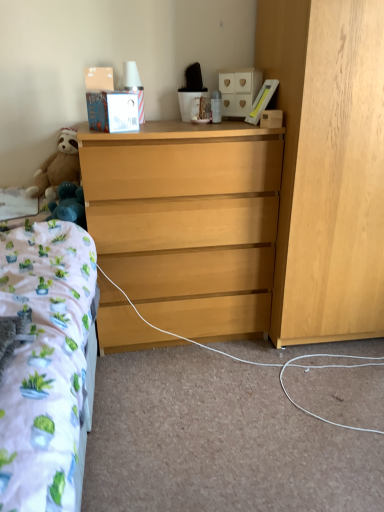
What do you see at coordinates (327, 166) in the screenshot? The width and height of the screenshot is (384, 512). I see `light wood dresser at right, which is the 1th cabinetry from bottom to top` at bounding box center [327, 166].

The image size is (384, 512). Describe the element at coordinates (239, 90) in the screenshot. I see `white matte cabinet at upper center, the 2th cabinetry from the right` at that location.

Find the location of a particular element. The image size is (384, 512). light wood dresser at right, the 2th cabinetry in the left-to-right sequence is located at coordinates (327, 166).

Which point is more distant from viewer, (117, 309) or (75, 181)?

Positioned behind is point (75, 181).

Considering their positions, is light wood dresser at center located in front of or behind brown plush teddy bear at left?

light wood dresser at center is positioned closer to the viewer than brown plush teddy bear at left.

Based on the photo, from their relative heights in the image, would you say light wood dresser at center is taller or shorter than brown plush teddy bear at left?

In the image, light wood dresser at center appears to be taller than brown plush teddy bear at left.

Which is in front, point (254, 280) or point (73, 201)?

The point (73, 201) is in front.

Is light wood dresser at center positioned with its back to blue plush toy at left?

No, light wood dresser at center is not facing the opposite direction of blue plush toy at left.

Based on the photo, which of these two, light wood dresser at center or blue plush toy at left, is wider?

Wider between the two is light wood dresser at center.

Can you tell me how much light wood dresser at center and blue plush toy at left differ in facing direction?

0.427 degrees separate the facing orientations of light wood dresser at center and blue plush toy at left.

Based on the photo, could you tell me if blue plush toy at left is facing white matte cabinet at upper center, which appears as the second cabinetry when ordered from the bottom?

No, blue plush toy at left is not aimed at white matte cabinet at upper center, which appears as the second cabinetry when ordered from the bottom.

Considering the sizes of blue plush toy at left and white matte cabinet at upper center, which appears as the second cabinetry when ordered from the bottom, in the image, is blue plush toy at left wider or thinner than white matte cabinet at upper center, which appears as the second cabinetry when ordered from the bottom,?

Considering their sizes, blue plush toy at left looks broader than white matte cabinet at upper center, which appears as the second cabinetry when ordered from the bottom.

Between point (81, 197) and point (233, 90), which one is positioned in front?

The point (81, 197) is closer.

Do you think wooden box at upper right is within light wood dresser at right, which is the first cabinetry from right to left, or outside of it?

wooden box at upper right is spatially situated outside light wood dresser at right, which is the first cabinetry from right to left.

Relative to light wood dresser at right, which is the 1th cabinetry from bottom to top, is wooden box at upper right in front or behind?

In the image, wooden box at upper right appears behind light wood dresser at right, which is the 1th cabinetry from bottom to top.

From the image's perspective, which is below, blue plush toy at left or wooden box at upper right?

blue plush toy at left.

Is blue plush toy at left not near wooden box at upper right?

blue plush toy at left is near wooden box at upper right, not far away.

How different are the orientations of blue plush toy at left and wooden box at upper right in degrees?

They differ by 0.209 degrees in their facing directions.

Does blue plush toy at left have a greater height compared to wooden box at upper right?

Correct, blue plush toy at left is much taller as wooden box at upper right.

In the scene shown: Considering the relative positions of light wood dresser at center and white matte cabinet at upper center, which appears as the second cabinetry when ordered from the bottom, in the image provided, is light wood dresser at center to the left or to the right of white matte cabinet at upper center, which appears as the second cabinetry when ordered from the bottom,?

Based on their positions, light wood dresser at center is located to the left of white matte cabinet at upper center, which appears as the second cabinetry when ordered from the bottom.

In the image, is light wood dresser at center positioned in front of or behind white matte cabinet at upper center, the first cabinetry when ordered from left to right?

light wood dresser at center is positioned closer to the viewer than white matte cabinet at upper center, the first cabinetry when ordered from left to right.

Can you confirm if light wood dresser at center is wider than white matte cabinet at upper center, the 2th cabinetry from the right?

Correct, the width of light wood dresser at center exceeds that of white matte cabinet at upper center, the 2th cabinetry from the right.

How different are the orientations of light wood dresser at center and white matte cabinet at upper center, the 2th cabinetry from the right, in degrees?

46.9 degrees separate the facing orientations of light wood dresser at center and white matte cabinet at upper center, the 2th cabinetry from the right.

Is light wood dresser at center at the back of brown plush teddy bear at left?

That's not correct — brown plush teddy bear at left is not looking away from light wood dresser at center.

Is brown plush teddy bear at left positioned behind light wood dresser at center?

Yes, brown plush teddy bear at left is further from the camera.

Is brown plush teddy bear at left not within light wood dresser at center?

brown plush teddy bear at left is positioned outside light wood dresser at center.

Identify the location of teddy bear that is above the light wood dresser at center (from the image's perspective). This screenshot has height=512, width=384. (58, 166).

Where is `desk in front of the blue plush toy at left`? The image size is (384, 512). desk in front of the blue plush toy at left is located at coordinates (187, 221).

Which object lies nearer to the anchor point light wood dresser at right, the 2th cabinetry from the top, white matte cabinet at upper center, acting as the 1th cabinetry starting from the top, or wooden box at upper right?

wooden box at upper right is positioned closer to the anchor light wood dresser at right, the 2th cabinetry from the top.

Looking at the image, which one is located closer to light wood dresser at right, the 2th cabinetry in the left-to-right sequence, white matte cabinet at upper center, the 2th cabinetry from the right, or blue plush toy at left?

Among the two, white matte cabinet at upper center, the 2th cabinetry from the right, is located nearer to light wood dresser at right, the 2th cabinetry in the left-to-right sequence.

Estimate the real-world distances between objects in this image. Which object is further from light wood dresser at center, white matte cabinet at upper center, the 2th cabinetry from the right, or wooden box at upper right?

Based on the image, white matte cabinet at upper center, the 2th cabinetry from the right, appears to be further to light wood dresser at center.

When comparing their distances from brown plush teddy bear at left, does white matte cabinet at upper center, which appears as the second cabinetry when ordered from the bottom, or light wood dresser at right, the 2th cabinetry in the left-to-right sequence, seem closer?

white matte cabinet at upper center, which appears as the second cabinetry when ordered from the bottom, is closer to brown plush teddy bear at left.

Looking at the image, which one is located closer to light wood dresser at right, which is the first cabinetry from right to left, brown plush teddy bear at left or wooden box at upper right?

wooden box at upper right is closer to light wood dresser at right, which is the first cabinetry from right to left.

Estimate the real-world distances between objects in this image. Which object is closer to white matte cabinet at upper center, the first cabinetry when ordered from left to right, wooden box at upper right or light wood dresser at center?

The object closer to white matte cabinet at upper center, the first cabinetry when ordered from left to right, is wooden box at upper right.

Considering their positions, is brown plush teddy bear at left positioned closer to wooden box at upper right than white matte cabinet at upper center, the 2th cabinetry from the right?

white matte cabinet at upper center, the 2th cabinetry from the right, lies closer to wooden box at upper right than the other object.

Considering their positions, is brown plush teddy bear at left positioned closer to wooden box at upper right than light wood dresser at right, which is the first cabinetry from right to left?

The object closer to wooden box at upper right is light wood dresser at right, which is the first cabinetry from right to left.

The width and height of the screenshot is (384, 512). What are the coordinates of `box between blue plush toy at left and light wood dresser at right, the 2th cabinetry from the top` in the screenshot? It's located at (271, 119).

The image size is (384, 512). I want to click on cabinetry situated between light wood dresser at center and light wood dresser at right, which is the first cabinetry from right to left, from left to right, so click(239, 90).

Identify the location of desk situated between brown plush teddy bear at left and white matte cabinet at upper center, the first cabinetry when ordered from left to right, from left to right. This screenshot has height=512, width=384. point(187,221).

Image resolution: width=384 pixels, height=512 pixels. Find the location of `box between white matte cabinet at upper center, which appears as the second cabinetry when ordered from the bottom, and light wood dresser at right, the 2th cabinetry from the top, from left to right`. box between white matte cabinet at upper center, which appears as the second cabinetry when ordered from the bottom, and light wood dresser at right, the 2th cabinetry from the top, from left to right is located at coordinates (271, 119).